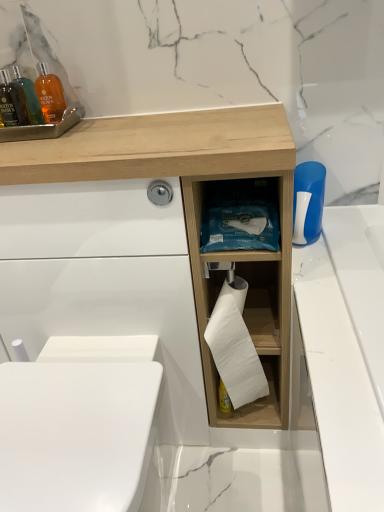
This screenshot has width=384, height=512. What do you see at coordinates (12, 102) in the screenshot?
I see `translucent amber bottle at upper left, which is counted as the first mouthwash, starting from the front` at bounding box center [12, 102].

What do you see at coordinates (29, 95) in the screenshot? I see `translucent orange bottle at upper left, positioned as the 2th mouthwash in front-to-back order` at bounding box center [29, 95].

Consider the image. Measure the distance between point [86,124] and camera.

Point [86,124] and camera are 3.29 feet apart.

What do you see at coordinates (75, 434) in the screenshot?
I see `white glossy toilet bowl at lower left` at bounding box center [75, 434].

Locate an element on the screen. white matte toilet paper at center is located at coordinates (235, 346).

You are a GUI agent. You are given a task and a screenshot of the screen. Output one action in this format:
    pyautogui.click(x=<x>, y=<y>)
    Task: Click on the blue plastic brush at right
    
    Given the screenshot: What is the action you would take?
    pyautogui.click(x=308, y=202)

Is white matte toilet paper at center looking in the opposite direction of blue plastic brush at right?

No.

Considering the sizes of objects white matte toilet paper at center and blue plastic brush at right in the image provided, who is taller, white matte toilet paper at center or blue plastic brush at right?

With more height is white matte toilet paper at center.

From a real-world perspective, who is located lower, white matte toilet paper at center or blue plastic brush at right?

white matte toilet paper at center, from a real-world perspective.

How different are the orientations of white matte toilet paper at center and blue plastic brush at right in degrees?

They differ by 1.13 degrees in their facing directions.

From the image's perspective, which is above, translucent orange bottle at upper left, marked as the 1th mouthwash in a back-to-front arrangement, or translucent amber bottle at upper left, which is counted as the first mouthwash, starting from the front?

translucent orange bottle at upper left, marked as the 1th mouthwash in a back-to-front arrangement, is shown above in the image.

Does point (16, 65) come behind point (11, 98)?

Yes, it is behind point (11, 98).

Is translucent orange bottle at upper left, marked as the 1th mouthwash in a back-to-front arrangement, smaller than translucent amber bottle at upper left, which is counted as the first mouthwash, starting from the front?

Indeed, translucent orange bottle at upper left, marked as the 1th mouthwash in a back-to-front arrangement, has a smaller size compared to translucent amber bottle at upper left, which is counted as the first mouthwash, starting from the front.

Is translucent amber bottle at upper left, the 2th mouthwash positioned from the back, completely or partially inside translucent orange bottle at upper left, marked as the 1th mouthwash in a back-to-front arrangement?

Definitely not — translucent amber bottle at upper left, the 2th mouthwash positioned from the back, is not inside translucent orange bottle at upper left, marked as the 1th mouthwash in a back-to-front arrangement.

From the image's perspective, is white matte toilet paper at center positioned above or below translucent amber bottle at upper left, the 2th mouthwash positioned from the back?

Based on their image positions, white matte toilet paper at center is located beneath translucent amber bottle at upper left, the 2th mouthwash positioned from the back.

Is white matte toilet paper at center bigger than translucent amber bottle at upper left, which is counted as the first mouthwash, starting from the front?

Yes, white matte toilet paper at center is bigger than translucent amber bottle at upper left, which is counted as the first mouthwash, starting from the front.

Is white matte toilet paper at center aimed at translucent amber bottle at upper left, which is counted as the first mouthwash, starting from the front?

No, white matte toilet paper at center is not turned towards translucent amber bottle at upper left, which is counted as the first mouthwash, starting from the front.

Which object is thinner, white matte toilet paper at center or translucent amber bottle at upper left, which is counted as the first mouthwash, starting from the front?

Thinner between the two is translucent amber bottle at upper left, which is counted as the first mouthwash, starting from the front.

From a real-world perspective, is wooden tissue box at center below white matte toilet paper at center?

Actually, wooden tissue box at center is physically above white matte toilet paper at center in the real world.

From the picture: From the image's perspective, which one is positioned lower, wooden tissue box at center or white matte toilet paper at center?

From the image's view, white matte toilet paper at center is below.

How different are the orientations of wooden tissue box at center and white matte toilet paper at center in degrees?

0.611 degrees.

Is wooden tissue box at center facing away from white matte toilet paper at center?

wooden tissue box at center is not turned away from white matte toilet paper at center.

In the scene shown: Is the position of wooden tissue box at center less distant than that of blue plastic brush at right?

Yes, the depth of wooden tissue box at center is less than that of blue plastic brush at right.

Considering the sizes of objects wooden tissue box at center and blue plastic brush at right in the image provided, who is smaller, wooden tissue box at center or blue plastic brush at right?

blue plastic brush at right.

From a real-world perspective, is wooden tissue box at center above or below blue plastic brush at right?

From a real-world perspective, wooden tissue box at center is physically below blue plastic brush at right.

Is wooden tissue box at center inside the boundaries of blue plastic brush at right, or outside?

wooden tissue box at center is spatially situated outside blue plastic brush at right.

Locate an element on the screen. The image size is (384, 512). cleaning product lying above the white matte toilet paper at center (from the image's perspective) is located at coordinates click(308, 202).

Considering the positions of point (310, 215) and point (223, 327), is point (310, 215) closer or farther from the camera than point (223, 327)?

Clearly, point (310, 215) is more distant from the camera than point (223, 327).

From a real-world perspective, who is located higher, blue plastic brush at right or white matte toilet paper at center?

blue plastic brush at right is physically above.

From the image's perspective, is blue plastic brush at right over white matte toilet paper at center?

Yes.

Is point (0, 78) closer or farther from the camera than point (295, 199)?

Point (0, 78) is farther from the camera than point (295, 199).

Which of these two, translucent amber bottle at upper left, which is counted as the first mouthwash, starting from the front, or blue plastic brush at right, is thinner?

Thinner between the two is translucent amber bottle at upper left, which is counted as the first mouthwash, starting from the front.

How many degrees apart are the facing directions of translucent amber bottle at upper left, the 2th mouthwash positioned from the back, and blue plastic brush at right?

0.539 degrees separate the facing orientations of translucent amber bottle at upper left, the 2th mouthwash positioned from the back, and blue plastic brush at right.

In the scene shown: Is translucent amber bottle at upper left, which is counted as the first mouthwash, starting from the front, shorter than blue plastic brush at right?

In fact, translucent amber bottle at upper left, which is counted as the first mouthwash, starting from the front, may be taller than blue plastic brush at right.

Identify the location of toilet paper lying in front of the blue plastic brush at right. Image resolution: width=384 pixels, height=512 pixels. (235, 346).

Locate an element on the screen. Image resolution: width=384 pixels, height=512 pixels. mouthwash on the left of translucent orange bottle at upper left, marked as the 1th mouthwash in a back-to-front arrangement is located at coordinates (12, 102).

Which object lies further to the anchor point white matte toilet paper at center, wooden tissue box at center or translucent amber bottle at upper left, which is counted as the first mouthwash, starting from the front?

translucent amber bottle at upper left, which is counted as the first mouthwash, starting from the front.

Looking at the image, which one is located further to wooden tissue box at center, translucent amber bottle at upper left, which is counted as the first mouthwash, starting from the front, or white matte toilet paper at center?

translucent amber bottle at upper left, which is counted as the first mouthwash, starting from the front.

Consider the image. Considering their positions, is white matte toilet paper at center positioned further to blue plastic brush at right than translucent orange bottle at upper left, positioned as the 2th mouthwash in front-to-back order?

Among the two, translucent orange bottle at upper left, positioned as the 2th mouthwash in front-to-back order, is located further to blue plastic brush at right.

In the scene shown: Looking at the image, which one is located closer to white matte toilet paper at center, translucent amber bottle at upper left, the 2th mouthwash positioned from the back, or translucent orange bottle at upper left, marked as the 1th mouthwash in a back-to-front arrangement?

translucent amber bottle at upper left, the 2th mouthwash positioned from the back, lies closer to white matte toilet paper at center than the other object.

Estimate the real-world distances between objects in this image. Which object is further from wooden tissue box at center, white matte toilet paper at center or translucent orange bottle at upper left, marked as the 1th mouthwash in a back-to-front arrangement?

translucent orange bottle at upper left, marked as the 1th mouthwash in a back-to-front arrangement, lies further to wooden tissue box at center than the other object.

Which object lies nearer to the anchor point translucent orange bottle at upper left, positioned as the 2th mouthwash in front-to-back order, blue plastic brush at right or translucent amber bottle at upper left, the 2th mouthwash positioned from the back?

Based on the image, translucent amber bottle at upper left, the 2th mouthwash positioned from the back, appears to be nearer to translucent orange bottle at upper left, positioned as the 2th mouthwash in front-to-back order.

Based on the photo, from the image, which object appears to be farther from translucent orange bottle at upper left, positioned as the 2th mouthwash in front-to-back order, white glossy toilet bowl at lower left or white matte toilet paper at center?

white matte toilet paper at center.

Which object lies further to the anchor point wooden tissue box at center, white matte toilet paper at center or blue plastic brush at right?

Among the two, blue plastic brush at right is located further to wooden tissue box at center.

Find the location of a particular element. Image resolution: width=384 pixels, height=512 pixels. toilet paper between blue plastic brush at right and white glossy toilet bowl at lower left in the up-down direction is located at coordinates (235, 346).

You are a GUI agent. You are given a task and a screenshot of the screen. Output one action in this format:
    pyautogui.click(x=<x>, y=<y>)
    Task: Click on the toilet bowl between wooden tissue box at center and blue plastic brush at right from left to right
    This screenshot has width=384, height=512.
    Given the screenshot: What is the action you would take?
    pyautogui.click(x=75, y=434)

Find the location of a particular element. bathroom cabinet between translucent amber bottle at upper left, the 2th mouthwash positioned from the back, and white matte toilet paper at center in the up-down direction is located at coordinates click(x=193, y=210).

Find the location of a particular element. This screenshot has height=512, width=384. bathroom cabinet between translucent amber bottle at upper left, the 2th mouthwash positioned from the back, and blue plastic brush at right, in the horizontal direction is located at coordinates (193, 210).